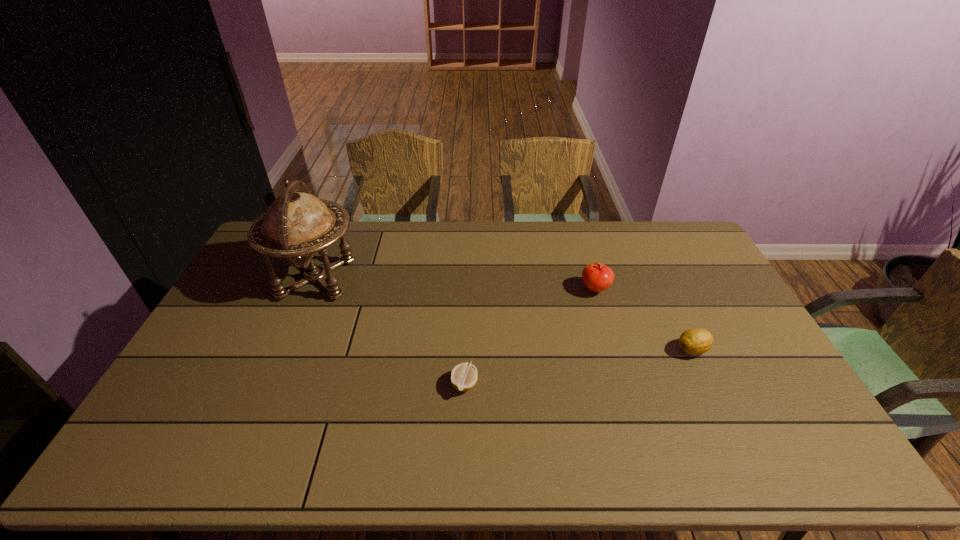
Where is `the leftmost object`? the leftmost object is located at coordinates (296, 225).

Identify the location of the tallest object. Image resolution: width=960 pixels, height=540 pixels. pyautogui.click(x=296, y=225).

Image resolution: width=960 pixels, height=540 pixels. Identify the location of the third shortest object. (597, 277).

Locate an element on the screen. apple is located at coordinates (597, 277).

Where is `the rightmost object`? the rightmost object is located at coordinates (695, 341).

Locate an element on the screen. The image size is (960, 540). the second shortest object is located at coordinates 695,341.

You are a GUI agent. You are given a task and a screenshot of the screen. Output one action in this format:
    pyautogui.click(x=<x>, y=<y>)
    Task: Click on the shortest object
    
    Given the screenshot: What is the action you would take?
    pyautogui.click(x=464, y=376)

Find the location of a particular element. This screenshot has width=960, height=540. the third object from right to left is located at coordinates (464, 376).

The image size is (960, 540). Find the location of `free point located 0.350m on the front-facing side of the leftmost object`. free point located 0.350m on the front-facing side of the leftmost object is located at coordinates (462, 279).

Find the location of a particular element. This screenshot has height=540, width=960. free space located 0.230m on the back of the apple is located at coordinates (581, 240).